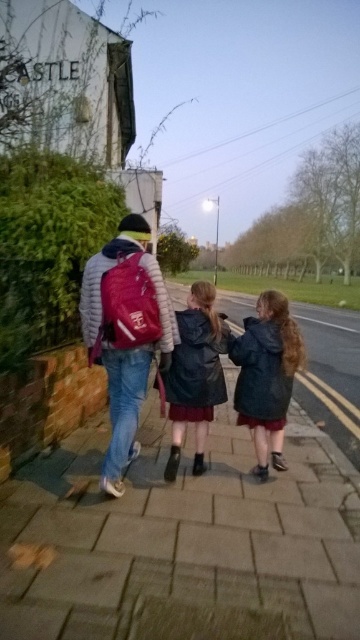
Question: Is matte pink backpack at left above leather jacket at center?

Choices:
 (A) yes
 (B) no

Answer: (A)

Question: Can you confirm if paved stone sidewalk at center is positioned to the left of matte pink backpack at left?

Choices:
 (A) yes
 (B) no

Answer: (B)

Question: Which point is closer to the camera taking this photo?

Choices:
 (A) (195, 467)
 (B) (290, 372)
 (C) (97, 316)
 (D) (57, 637)

Answer: (D)

Question: In this image, where is paved stone sidewalk at center located relative to dark blue jacket at center?

Choices:
 (A) left
 (B) right

Answer: (A)

Question: Which point is farther to the camera?

Choices:
 (A) leather jacket at center
 (B) matte pink backpack at left

Answer: (A)

Question: Estimate the real-world distances between objects in this image. Which object is farther from the leather jacket at center?

Choices:
 (A) paved stone sidewalk at center
 (B) matte pink backpack at left
 (C) dark blue jacket at center

Answer: (A)